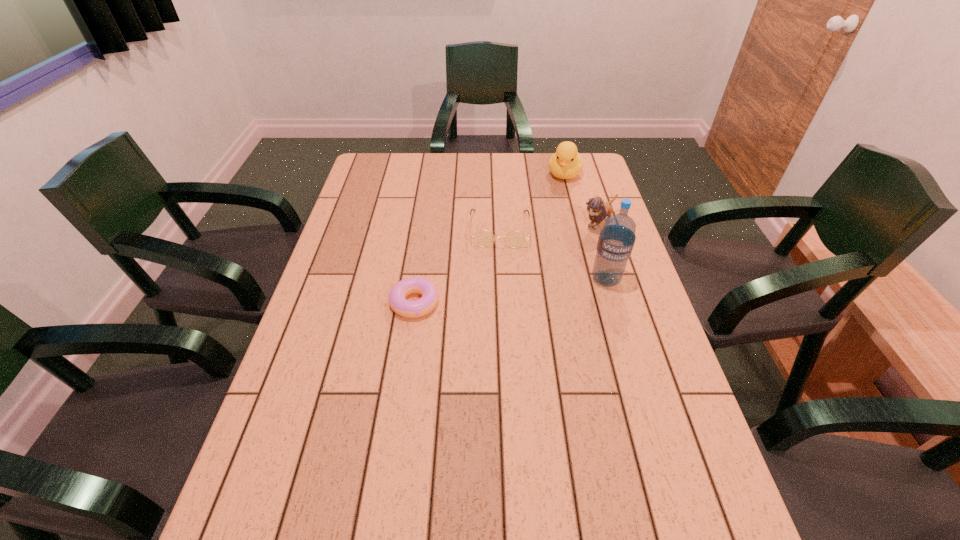
Locate an element on the screen. The width and height of the screenshot is (960, 540). water bottle that is positioned at the right edge is located at coordinates (617, 237).

I want to click on duck situated at the right edge, so click(566, 163).

Identify the location of kitten that is at the right edge. This screenshot has width=960, height=540. (598, 210).

Where is `object that is at the far right corner`? object that is at the far right corner is located at coordinates (566, 163).

The width and height of the screenshot is (960, 540). I want to click on free space at the far edge of the desktop, so click(513, 184).

This screenshot has height=540, width=960. Identify the location of vacant space at the near edge of the desktop. (573, 467).

Where is `free space at the left edge`? This screenshot has width=960, height=540. free space at the left edge is located at coordinates (280, 397).

Identify the location of free space at the right edge of the desktop. The width and height of the screenshot is (960, 540). (629, 402).

At what (x,y) coordinates should I click in order to perform the action: click on vacant space at the far left corner of the desktop. Please return your answer as a coordinate pair (x, y). The height and width of the screenshot is (540, 960). Looking at the image, I should click on (380, 174).

Identify the location of vacant point at the near right corner. (636, 490).